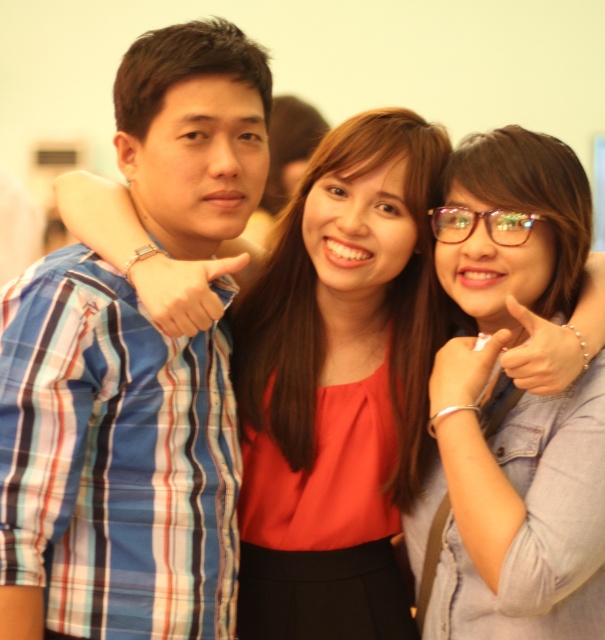
You are standing in front of the group photo and want to identify the person wearing the blue plaid shirt at left. Based on their position, can you determine if they are closer to the camera compared to the other two individuals?

The blue plaid shirt at left is located at point (111, 464), which does not provide enough information to determine if they are closer to the camera than the other individuals. The coordinates only indicate their position within the image frame, not their depth relative to the camera.